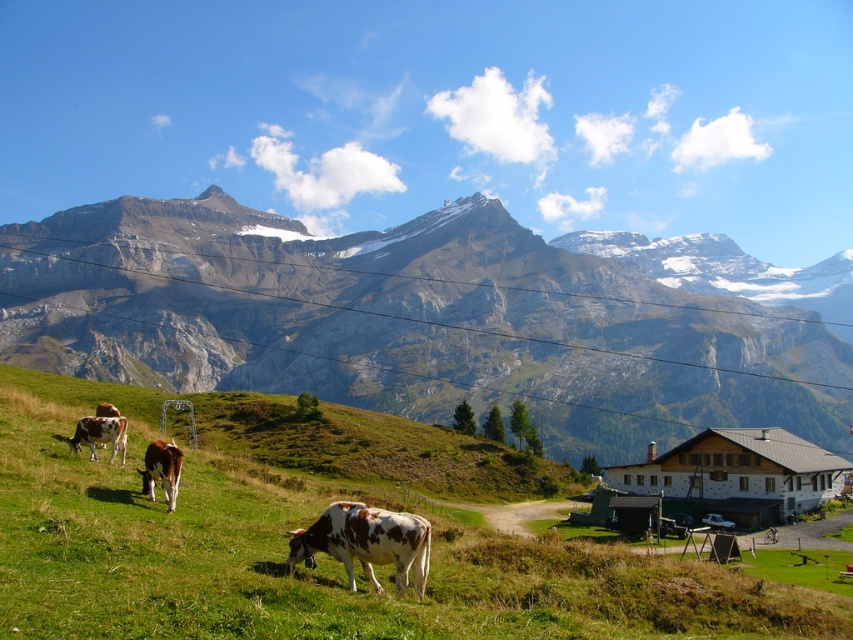
You are a farmer checking the health of your cows. You notice that the brown and white spotted cow at lower center and the brown and white spotted cow at lower left have different heights. Which cow should you prioritize for a health check based on its size?

The brown and white spotted cow at lower center is much taller than the brown and white spotted cow at lower left, so you should prioritize the brown and white spotted cow at lower center for a health check due to its larger size.

You are standing at the edge of the meadow looking towards the mountains. You see the brown and white spotted cow at lower center and the brown speckled cow at lower left. Which cow is closer to you?

The brown and white spotted cow at lower center is closer to you because it is in front of the brown speckled cow at lower left.

You are standing at the top of the mountain overlooking the meadow. You see two cows, the brown and white spotted cow at lower center and the brown and white spotted cow at lower left. Which cow is positioned lower in the image?

The brown and white spotted cow at lower center is positioned lower in the image than the brown and white spotted cow at lower left.